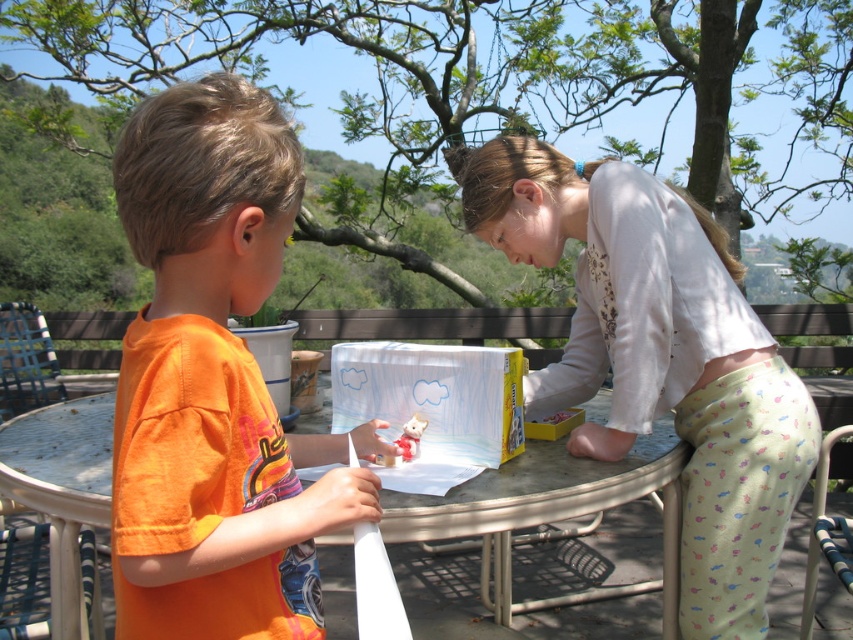
You are a photographer trying to capture a photo of the orange cotton shirt at center and the light beige cotton shirt at center. Since you want to ensure both shirts are visible in the frame, which shirt should you focus on first to make sure the other is also in focus?

The orange cotton shirt at center is located above the light beige cotton shirt at center. Since the orange cotton shirt is higher up, focusing on it first would naturally include the lower positioned light beige cotton shirt in the frame as well, ensuring both are visible.

You are a photographer trying to capture the orange cotton shirt at center and the metallic silver table at center in a single shot. Can you frame the scene so both objects are visible without moving any of them?

The orange cotton shirt at center is positioned over metallic silver table at center, so both objects are already visible together in the scene. Yes, you can frame the scene so both are visible without moving them.

You are standing in front of a table where a child is wearing an orange cotton shirt at center. If you want to hand them a craft material from your current position, will you be able to reach them without moving closer? The average human arm length is about 25 inches.

The orange cotton shirt at center and the viewer are 31.15 inches apart. Since the average arm length is 25 inches, you would need to move closer to reach the child wearing the orange cotton shirt at center.